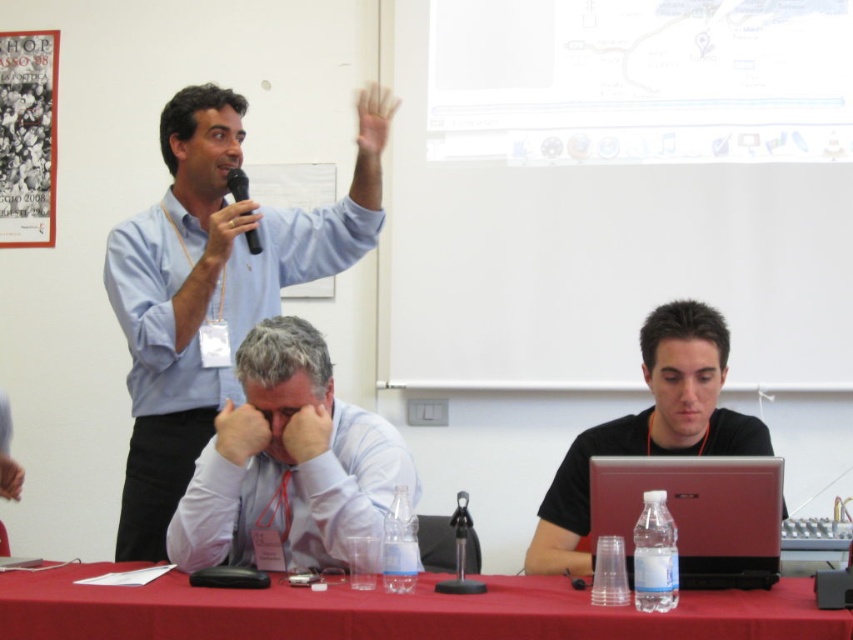
You are organizing a small event and need to place a 15 cm wide decorative plate on the table. Given the size difference between the red cloth table at lower center and the smooth skin hand at center, can you estimate if the table has enough space for the plate?

The red cloth table at lower center is larger than the smooth skin hand at center. Since the hand is typically smaller than 15 cm in width, the table likely has sufficient space for the 15 cm wide decorative plate.

You are organizing a small event and need to place a 10 inch wide decorative plate between the red cloth table at lower center and the white shirt at center. Can you fit it there?

The distance between the red cloth table at lower center and the white shirt at center is 9.81 inches, which is slightly less than the 10 inch wide plate. Therefore, the plate cannot fit in that space.

You are organizing a presentation and need to place a name tag on the table. The name tag is 12 cm wide. Can the black matte laptop at lower right or the matte white hand at center accommodate the name tag next to them?

The black matte laptop at lower right has a larger width than the matte white hand at center. Since the name tag is 12 cm wide, the black matte laptop at lower right would provide more space for placement compared to the matte white hand at center.